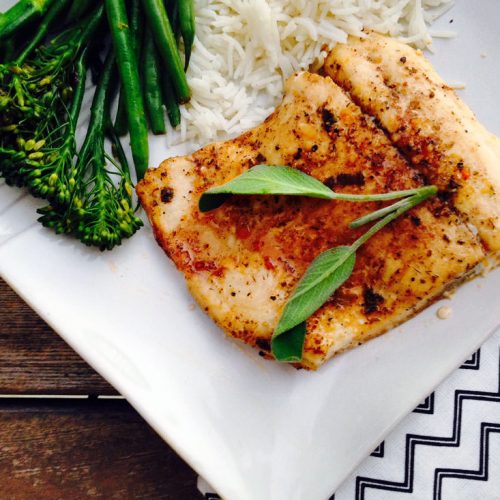
Locate an element on the screen. Image resolution: width=500 pixels, height=500 pixels. white square shaped plate is located at coordinates (116, 295), (361, 410).